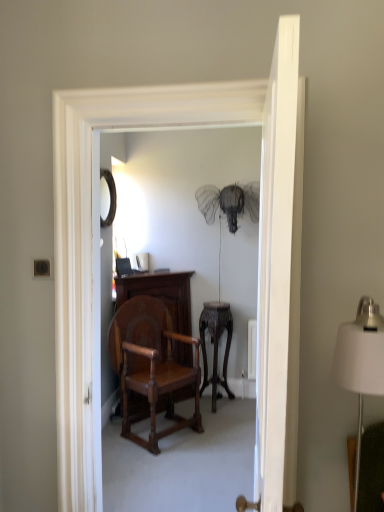
This screenshot has height=512, width=384. In order to click on vacant space to the right of polished wood chair at center in this screenshot , I will do `click(221, 436)`.